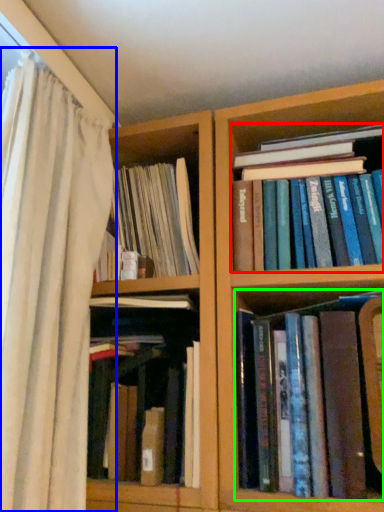
Question: Which object is positioned farthest from book (highlighted by a red box)? Select from curtain (highlighted by a blue box) and book (highlighted by a green box).

Choices:
 (A) curtain
 (B) book

Answer: (A)